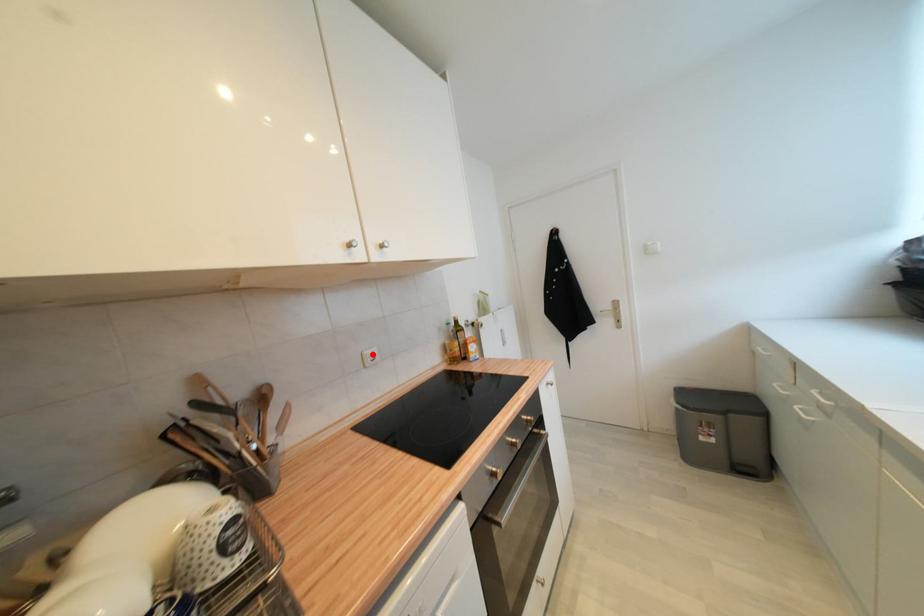
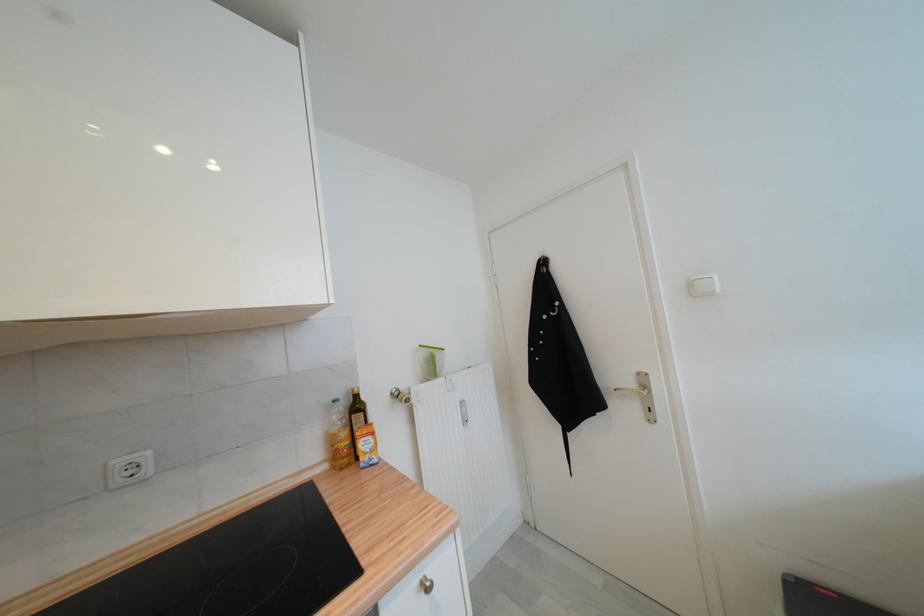
Locate, in the second image, the point that corresponds to the highlighted location in the first image.

(126, 464)